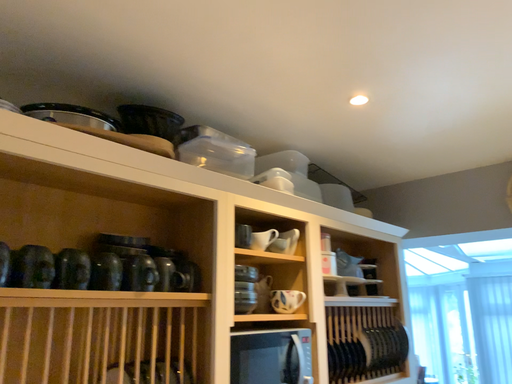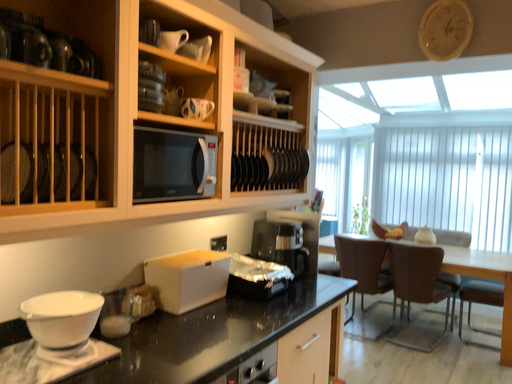
Question: How did the camera likely rotate when shooting the video?

Choices:
 (A) rotated downward
 (B) rotated upward

Answer: (A)